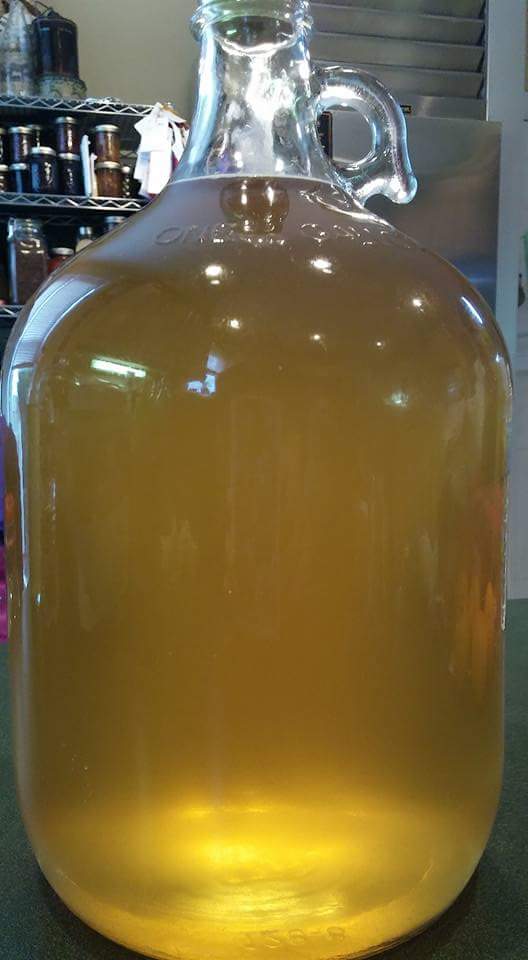
Where is `vents`? This screenshot has height=960, width=528. vents is located at coordinates (458, 8), (451, 34), (460, 62), (468, 84), (466, 107).